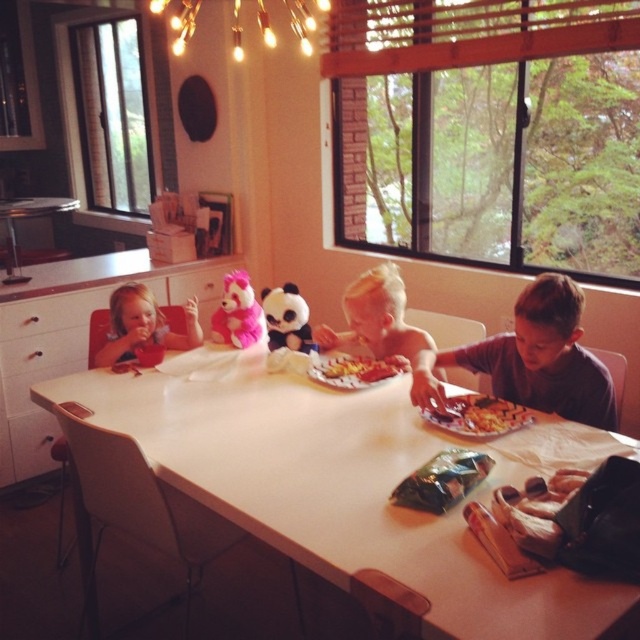
Does golden crispy fries at center come behind matte plush panda at center?

No, golden crispy fries at center is closer to the viewer.

Which is behind, point (484, 404) or point (275, 323)?

The point (275, 323) is behind.

Between point (477, 428) and point (285, 308), which one is positioned behind?

Point (285, 308)

Identify the location of golden crispy fries at center. Image resolution: width=640 pixels, height=640 pixels. (477, 416).

Is warm matte string lights at upper center above yellow paper plate at center?

Yes, warm matte string lights at upper center is above yellow paper plate at center.

Does warm matte string lights at upper center have a smaller size compared to yellow paper plate at center?

No, warm matte string lights at upper center is not smaller than yellow paper plate at center.

This screenshot has width=640, height=640. Find the location of `warm matte string lights at upper center`. warm matte string lights at upper center is located at coordinates (301, 22).

Which is more to the right, brown cotton shirt at center or warm matte string lights at upper center?

From the viewer's perspective, brown cotton shirt at center appears more on the right side.

Who is higher up, brown cotton shirt at center or warm matte string lights at upper center?

Positioned higher is warm matte string lights at upper center.

Which is in front, point (490, 352) or point (232, 8)?

Point (490, 352) is in front.

This screenshot has width=640, height=640. Find the location of `brown cotton shirt at center`. brown cotton shirt at center is located at coordinates (544, 356).